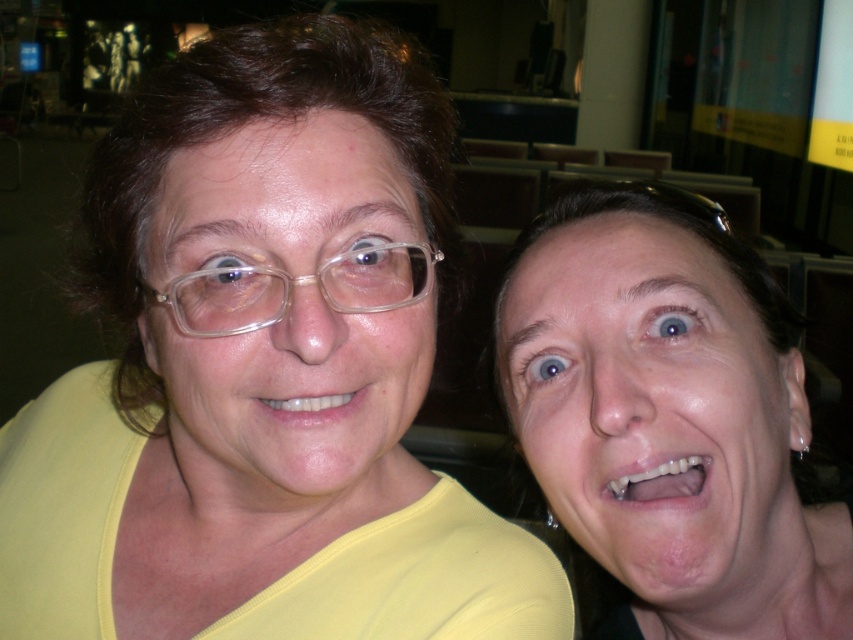
You are a photographer trying to focus your camera on the yellow matte shirt at upper left and the transparent plastic glasses at upper left. Which object should you adjust your focus to first if you want to capture both clearly in the same frame?

The yellow matte shirt at upper left is bigger than the transparent plastic glasses at upper left, so you should focus on the yellow matte shirt at upper left first to ensure it is sharp, then adjust for the smaller glasses to maintain clarity in both.

You are standing in a museum and see the matte yellow shirt at right. If you want to take a photo of it from the front, where should you position yourself relative to the shirt?

The matte yellow shirt at right is positioned at point [654,410], so you should position yourself directly in front of it to capture it from the front.